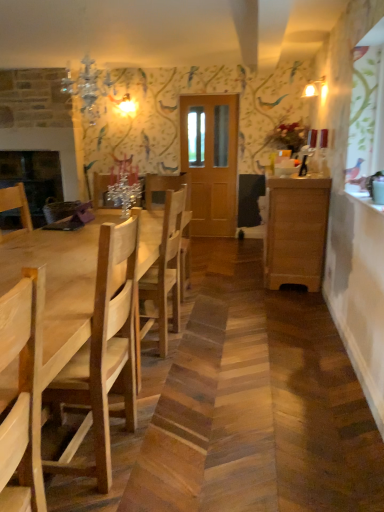
Measure the distance between wooden chair at left, which appears as the 2th chair when viewed from the back, and camera.

4.68 feet.

Identify the location of wooden chair at left, placed as the 1th chair when sorted from front to back. The width and height of the screenshot is (384, 512). (103, 355).

Is natural wood chair at center, which is the second chair in front-to-back order, next to wooden cabinet at right and touching it?

They are not placed beside each other.

Does natural wood chair at center, which is the second chair in front-to-back order, have a greater width compared to wooden cabinet at right?

Incorrect, the width of natural wood chair at center, which is the second chair in front-to-back order, does not surpass that of wooden cabinet at right.

Who is bigger, natural wood chair at center, the first chair positioned from the back, or wooden cabinet at right?

wooden cabinet at right is bigger.

From a real-world perspective, starting from the wooden cabinet at right, which chair is the 1st one vertically above it? Please provide its 2D coordinates.

[(167, 267)]

Between light brown wooden table at left and natural wood chair at center, the first chair positioned from the back, which one has more height?

natural wood chair at center, the first chair positioned from the back, is taller.

Looking at the image, does light brown wooden table at left seem bigger or smaller compared to natural wood chair at center, which is the second chair in front-to-back order?

In the image, light brown wooden table at left appears to be larger than natural wood chair at center, which is the second chair in front-to-back order.

Could you tell me if light brown wooden table at left is turned towards natural wood chair at center, which is the second chair in front-to-back order?

Yes, light brown wooden table at left is turned towards natural wood chair at center, which is the second chair in front-to-back order.

From the image's perspective, does light brown wooden table at left appear lower than natural wood chair at center, the first chair positioned from the back?

Yes, from the image's perspective, light brown wooden table at left is beneath natural wood chair at center, the first chair positioned from the back.

From the image's perspective, is natural wood chair at center, which is the second chair in front-to-back order, on wooden chair at left, placed as the 1th chair when sorted from front to back?

Yes, from the image's perspective, natural wood chair at center, which is the second chair in front-to-back order, is on top of wooden chair at left, placed as the 1th chair when sorted from front to back.

Would you say natural wood chair at center, the first chair positioned from the back, is to the left or to the right of wooden chair at left, which appears as the 2th chair when viewed from the back, in the picture?

Clearly, natural wood chair at center, the first chair positioned from the back, is on the right of wooden chair at left, which appears as the 2th chair when viewed from the back, in the image.

In terms of width, does natural wood chair at center, which is the second chair in front-to-back order, look wider or thinner when compared to wooden chair at left, which appears as the 2th chair when viewed from the back?

natural wood chair at center, which is the second chair in front-to-back order, is wider than wooden chair at left, which appears as the 2th chair when viewed from the back.

Which is correct: natural wood chair at center, the first chair positioned from the back, is inside wooden chair at left, which appears as the 2th chair when viewed from the back, or outside of it?

natural wood chair at center, the first chair positioned from the back, is outside wooden chair at left, which appears as the 2th chair when viewed from the back.

Could you measure the distance between wooden chair at left, which appears as the 2th chair when viewed from the back, and wooden cabinet at right?

wooden chair at left, which appears as the 2th chair when viewed from the back, and wooden cabinet at right are 2.37 meters apart from each other.

Which object is positioned more to the right, wooden chair at left, which appears as the 2th chair when viewed from the back, or wooden cabinet at right?

Positioned to the right is wooden cabinet at right.

Can you see wooden chair at left, which appears as the 2th chair when viewed from the back, touching wooden cabinet at right?

No, wooden chair at left, which appears as the 2th chair when viewed from the back, is not in contact with wooden cabinet at right.

From a real-world perspective, is wooden chair at left, which appears as the 2th chair when viewed from the back, above or below wooden cabinet at right?

Clearly, from a real-world perspective, wooden chair at left, which appears as the 2th chair when viewed from the back, is above wooden cabinet at right.

Is wooden cabinet at right further to the viewer compared to light brown wooden table at left?

That is True.

Does wooden cabinet at right have a larger size compared to light brown wooden table at left?

No.

Is wooden cabinet at right spatially inside light brown wooden table at left, or outside of it?

wooden cabinet at right lies outside light brown wooden table at left.

Does wooden cabinet at right have a greater height compared to light brown wooden table at left?

Correct, wooden cabinet at right is much taller as light brown wooden table at left.

Considering the relative sizes of wooden cabinet at right and wooden chair at left, placed as the 1th chair when sorted from front to back, in the image provided, is wooden cabinet at right taller than wooden chair at left, placed as the 1th chair when sorted from front to back,?

Incorrect, the height of wooden cabinet at right is not larger of that of wooden chair at left, placed as the 1th chair when sorted from front to back.

From the wooden cabinet at right, count the 2nd chair to the left and point to it. Please provide its 2D coordinates.

[(103, 355)]

Is wooden cabinet at right bigger or smaller than wooden chair at left, which appears as the 2th chair when viewed from the back?

Clearly, wooden cabinet at right is larger in size than wooden chair at left, which appears as the 2th chair when viewed from the back.

Are wooden cabinet at right and wooden chair at left, which appears as the 2th chair when viewed from the back, located far from each other?

Yes, wooden cabinet at right and wooden chair at left, which appears as the 2th chair when viewed from the back, are quite far apart.

Is natural wood chair at center, which is the second chair in front-to-back order, surrounding light brown wooden table at left?

No, light brown wooden table at left is not a part of natural wood chair at center, which is the second chair in front-to-back order.

Could you tell me if natural wood chair at center, which is the second chair in front-to-back order, is turned towards light brown wooden table at left?

Yes, natural wood chair at center, which is the second chair in front-to-back order, faces towards light brown wooden table at left.

Does point (173, 199) lie behind point (158, 223)?

No, it is not.

Identify the location of chair that is the 1st object to the left of the wooden cabinet at right, starting at the anchor. (167, 267).

Locate an element on the screen. chair above the light brown wooden table at left (from the image's perspective) is located at coordinates (167, 267).

Which object lies further to the anchor point light brown wooden table at left, natural wood chair at center, the first chair positioned from the back, or wooden cabinet at right?

wooden cabinet at right.

Which object lies nearer to the anchor point light brown wooden table at left, wooden cabinet at right or wooden chair at left, which appears as the 2th chair when viewed from the back?

Among the two, wooden chair at left, which appears as the 2th chair when viewed from the back, is located nearer to light brown wooden table at left.

When comparing their distances from light brown wooden table at left, does natural wood chair at center, which is the second chair in front-to-back order, or wooden chair at left, placed as the 1th chair when sorted from front to back, seem closer?

Among the two, wooden chair at left, placed as the 1th chair when sorted from front to back, is located nearer to light brown wooden table at left.

Considering their positions, is wooden chair at left, which appears as the 2th chair when viewed from the back, positioned closer to light brown wooden table at left than wooden cabinet at right?

wooden chair at left, which appears as the 2th chair when viewed from the back, is closer to light brown wooden table at left.

Looking at this image, which object lies nearer to the anchor point natural wood chair at center, the first chair positioned from the back, wooden cabinet at right or light brown wooden table at left?

light brown wooden table at left lies closer to natural wood chair at center, the first chair positioned from the back, than the other object.

Consider the image. Considering their positions, is wooden cabinet at right positioned closer to natural wood chair at center, the first chair positioned from the back, than wooden chair at left, placed as the 1th chair when sorted from front to back?

wooden chair at left, placed as the 1th chair when sorted from front to back, lies closer to natural wood chair at center, the first chair positioned from the back, than the other object.

Based on their spatial positions, is wooden chair at left, which appears as the 2th chair when viewed from the back, or wooden cabinet at right closer to natural wood chair at center, the first chair positioned from the back?

Among the two, wooden chair at left, which appears as the 2th chair when viewed from the back, is located nearer to natural wood chair at center, the first chair positioned from the back.

Considering their positions, is wooden chair at left, placed as the 1th chair when sorted from front to back, positioned closer to wooden cabinet at right than natural wood chair at center, the first chair positioned from the back?

natural wood chair at center, the first chair positioned from the back, is positioned closer to the anchor wooden cabinet at right.

Locate an element on the screen. chair between light brown wooden table at left and natural wood chair at center, which is the second chair in front-to-back order, along the z-axis is located at coordinates (103, 355).

I want to click on chair between wooden chair at left, placed as the 1th chair when sorted from front to back, and wooden cabinet at right, along the z-axis, so click(x=167, y=267).